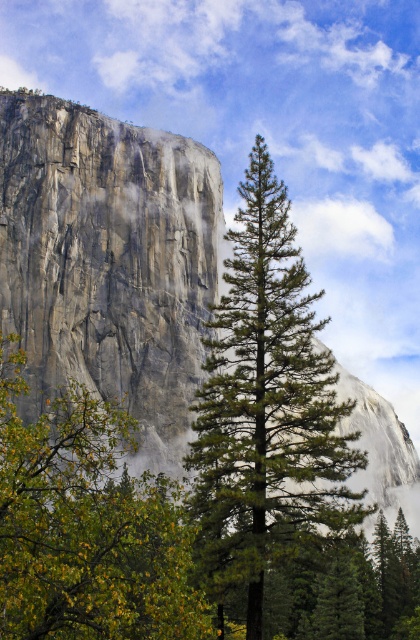
Is rocky cliff at center bigger than granite cliff face at left?

Indeed, rocky cliff at center has a larger size compared to granite cliff face at left.

Describe the element at coordinates (110, 260) in the screenshot. The image size is (420, 640). I see `rocky cliff at center` at that location.

I want to click on rocky cliff at center, so click(110, 260).

You are a GUI agent. You are given a task and a screenshot of the screen. Output one action in this format:
    pyautogui.click(x=<x>, y=<y>)
    Task: Click on the rocky cliff at center
    This screenshot has width=420, height=640.
    Given the screenshot: What is the action you would take?
    pyautogui.click(x=110, y=260)

Can you confirm if granite cliff face at left is bigger than green leafy tree at center?

Indeed, granite cliff face at left has a larger size compared to green leafy tree at center.

Where is `granite cliff face at left`? Image resolution: width=420 pixels, height=640 pixels. granite cliff face at left is located at coordinates (109, 262).

Identify the location of granite cliff face at left. (109, 262).

Does granite cliff face at left have a greater width compared to green textured pine tree at center?

Correct, the width of granite cliff face at left exceeds that of green textured pine tree at center.

Can you confirm if granite cliff face at left is positioned above green textured pine tree at center?

Yes, granite cliff face at left is above green textured pine tree at center.

Where is `granite cliff face at left`? This screenshot has width=420, height=640. granite cliff face at left is located at coordinates (109, 262).

The width and height of the screenshot is (420, 640). In order to click on granite cliff face at left in this screenshot , I will do `click(109, 262)`.